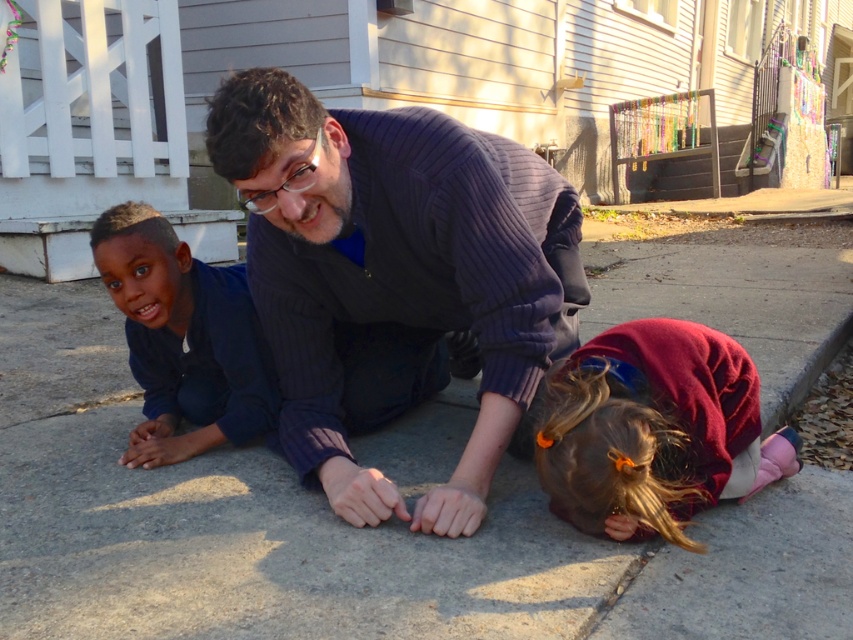
Is maroon fleece jacket at lower right smaller than smooth navy blue shirt at left?

No, maroon fleece jacket at lower right is not smaller than smooth navy blue shirt at left.

Does maroon fleece jacket at lower right appear under smooth navy blue shirt at left?

Yes, maroon fleece jacket at lower right is below smooth navy blue shirt at left.

Describe the element at coordinates (654, 429) in the screenshot. I see `maroon fleece jacket at lower right` at that location.

At what (x,y) coordinates should I click in order to perform the action: click on maroon fleece jacket at lower right. Please return your answer as a coordinate pair (x, y). The height and width of the screenshot is (640, 853). Looking at the image, I should click on (654, 429).

Does dark blue sweater at center have a greater width compared to maroon fleece jacket at lower right?

Yes.

Can you confirm if dark blue sweater at center is thinner than maroon fleece jacket at lower right?

Incorrect, dark blue sweater at center's width is not less than maroon fleece jacket at lower right's.

Does point (461, 248) lie behind point (666, 420)?

Yes, it is behind point (666, 420).

Where is `dark blue sweater at center`? The width and height of the screenshot is (853, 640). dark blue sweater at center is located at coordinates (395, 269).

Does dark blue sweater at center appear on the left side of smooth navy blue shirt at left?

In fact, dark blue sweater at center is to the right of smooth navy blue shirt at left.

Is dark blue sweater at center smaller than smooth navy blue shirt at left?

No.

This screenshot has width=853, height=640. In order to click on dark blue sweater at center in this screenshot , I will do `click(395, 269)`.

Find the location of a particular element. dark blue sweater at center is located at coordinates (395, 269).